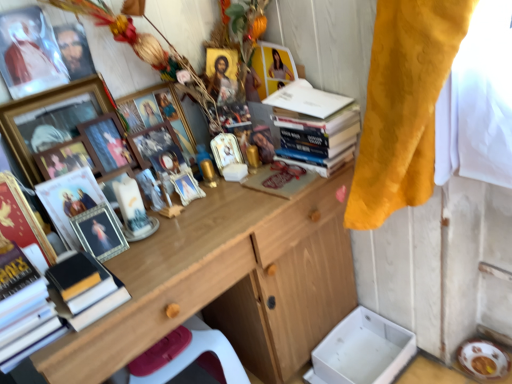
Question: Are matte brown book at center, arranged as the first magazine when viewed from the right, and hardcover book at left, the 2th book in the top-to-bottom sequence, beside each other?

Choices:
 (A) yes
 (B) no

Answer: (B)

Question: From a real-world perspective, is matte brown book at center, arranged as the first magazine when viewed from the right, under hardcover book at left, the 2th book in the top-to-bottom sequence?

Choices:
 (A) yes
 (B) no

Answer: (A)

Question: Does matte brown book at center, arranged as the first magazine when viewed from the right, have a lesser width compared to hardcover book at left, the 2th book in the top-to-bottom sequence?

Choices:
 (A) yes
 (B) no

Answer: (A)

Question: Is matte brown book at center, arranged as the first magazine when viewed from the right, positioned with its back to hardcover book at left, the first book from the left?

Choices:
 (A) no
 (B) yes

Answer: (A)

Question: Is matte brown book at center, arranged as the first magazine when viewed from the right, positioned behind hardcover book at left, the second book viewed from the right?

Choices:
 (A) yes
 (B) no

Answer: (A)

Question: From a real-world perspective, is matte brown book at center, arranged as the first magazine when viewed from the right, over hardcover book at left, the second book viewed from the right?

Choices:
 (A) no
 (B) yes

Answer: (A)

Question: Is wooden picture frame at center, which is the eighth picture frame from left to right, not close to wooden picture frame at center, which is counted as the third picture frame, starting from the right?

Choices:
 (A) yes
 (B) no

Answer: (B)

Question: From the image's perspective, would you say wooden picture frame at center, the second picture frame in the right-to-left sequence, is positioned over wooden picture frame at center, the 7th picture frame when ordered from left to right?

Choices:
 (A) yes
 (B) no

Answer: (A)

Question: Can you confirm if wooden picture frame at center, which is the eighth picture frame from left to right, is bigger than wooden picture frame at center, the 7th picture frame when ordered from left to right?

Choices:
 (A) yes
 (B) no

Answer: (A)

Question: Is wooden picture frame at center, the second picture frame in the right-to-left sequence, looking in the opposite direction of wooden picture frame at center, the 7th picture frame when ordered from left to right?

Choices:
 (A) yes
 (B) no

Answer: (B)

Question: From a real-world perspective, is wooden picture frame at center, which is the eighth picture frame from left to right, physically below wooden picture frame at center, the 7th picture frame when ordered from left to right?

Choices:
 (A) yes
 (B) no

Answer: (A)

Question: Considering the relative positions of wooden picture frame at center, the second picture frame in the right-to-left sequence, and wooden picture frame at center, which is counted as the third picture frame, starting from the right, in the image provided, is wooden picture frame at center, the second picture frame in the right-to-left sequence, in front of wooden picture frame at center, which is counted as the third picture frame, starting from the right,?

Choices:
 (A) yes
 (B) no

Answer: (B)

Question: Are matte gold picture frame at left, the first magazine when ordered from left to right, and gold-framed picture at upper left, which is the 8th picture frame in right-to-left order, far apart?

Choices:
 (A) yes
 (B) no

Answer: (B)